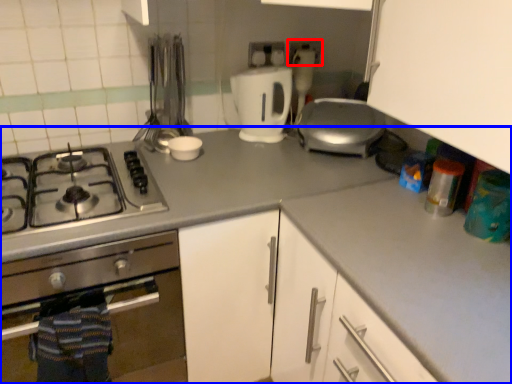
Question: Which of the following is the closest to the observer, electric outlet (highlighted by a red box) or countertop (highlighted by a blue box)?

Choices:
 (A) electric outlet
 (B) countertop

Answer: (B)